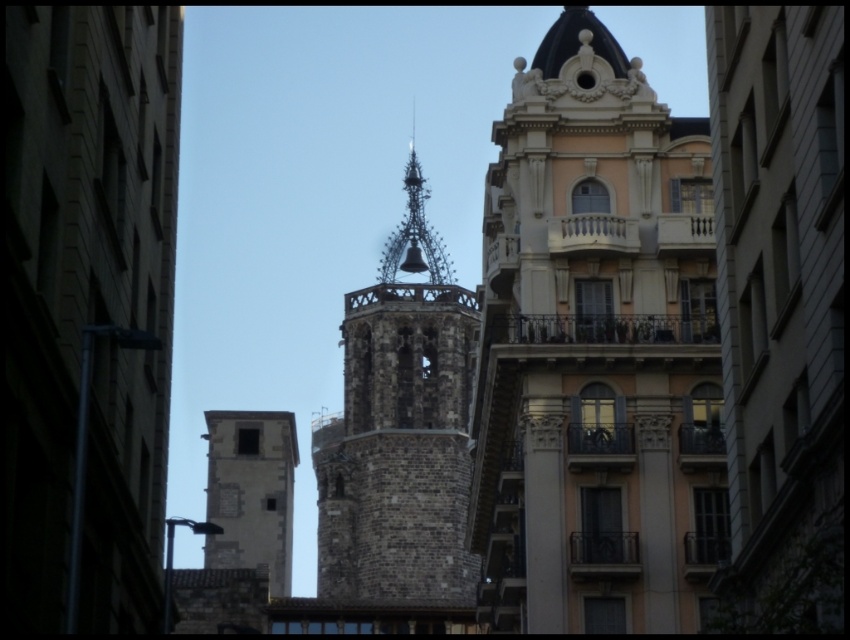
You are an urban planner reviewing this area. You need to determine the relative positions of the beige stone building at center and the brown stone tower at center. Which one is positioned to the right of the other?

The beige stone building at center is to the right of the brown stone tower at center.

You are standing in the urban setting and want to take a photo of both the brown stone tower at center and the dark brown stone spire at center. Which one should you focus on first to ensure both are in the frame?

Since the brown stone tower at center is closer to the viewer than the dark brown stone spire at center, you should focus on the dark brown stone spire at center first to ensure both are in the frame.

You are an architect analyzing the urban layout. You see the brown stone tower at center and the dark brown stone spire at center. Which one is positioned to the left?

The brown stone tower at center is positioned to the left of the dark brown stone spire at center.